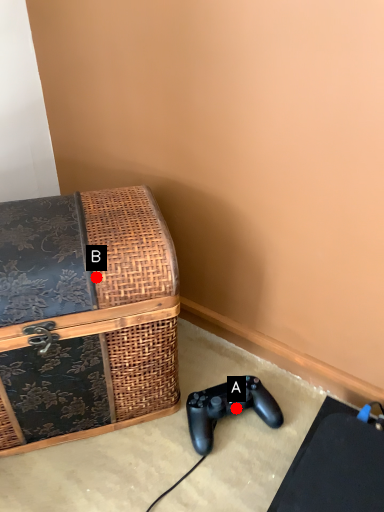
Question: Two points are circled on the image, labeled by A and B beside each circle. Which point is closer to the camera?

Choices:
 (A) A is closer
 (B) B is closer

Answer: (B)